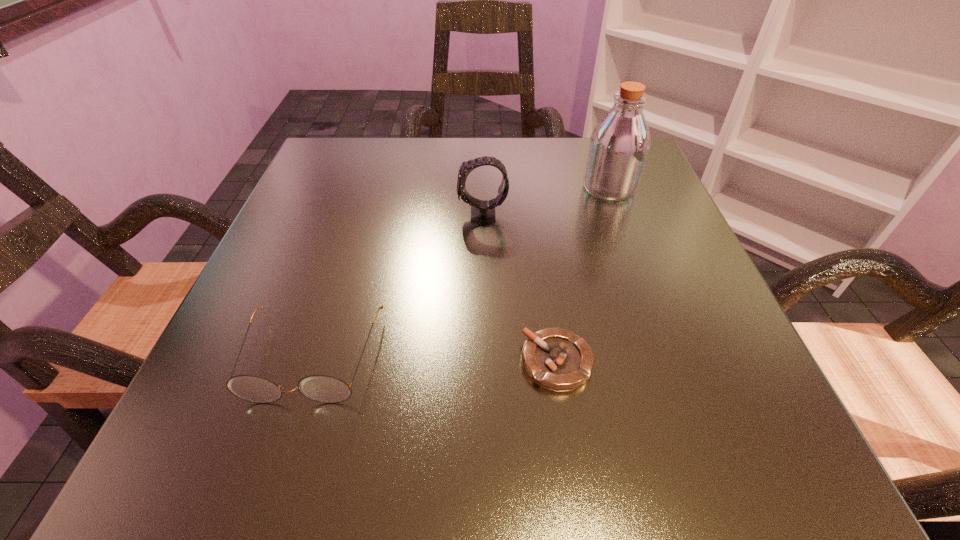
The image size is (960, 540). Identify the location of the farthest object. (619, 145).

Find the location of a particular element. The height and width of the screenshot is (540, 960). the rightmost object is located at coordinates (619, 145).

The height and width of the screenshot is (540, 960). I want to click on the third shortest object, so click(481, 211).

In order to click on the second farthest object in this screenshot , I will do `click(481, 211)`.

Where is `the second shortest object`? the second shortest object is located at coordinates (321, 388).

Identify the location of the leftmost object. (321, 388).

Locate an element on the screen. The height and width of the screenshot is (540, 960). ashtray is located at coordinates [556, 359].

What are the coordinates of `the shortest object` in the screenshot? It's located at (556, 359).

Identify the location of vacant area located 0.190m on the left of the tallest object. The image size is (960, 540). (490, 188).

At what (x,y) coordinates should I click in order to perform the action: click on vacant space located on the face of the second object from left to right. Please return your answer as a coordinate pair (x, y). Image resolution: width=960 pixels, height=540 pixels. Looking at the image, I should click on (384, 215).